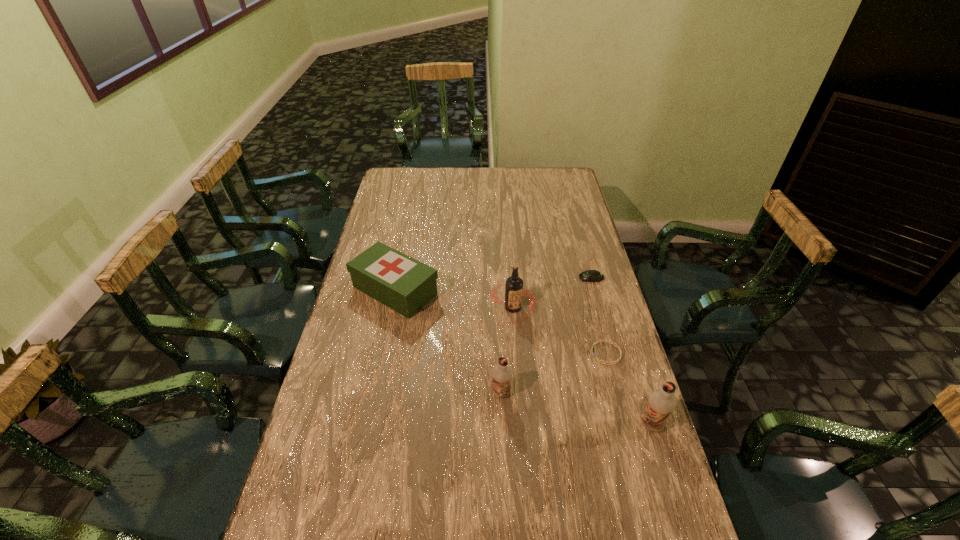
Please show where to add a chocolate milk on the left while keeping spacing even. Please provide its 2D coordinates. Your answer should be formatted as a tuple, i.e. [(x, y)], where the tuple contains the x and y coordinates of a point satisfying the conditions above.

[(367, 364)]